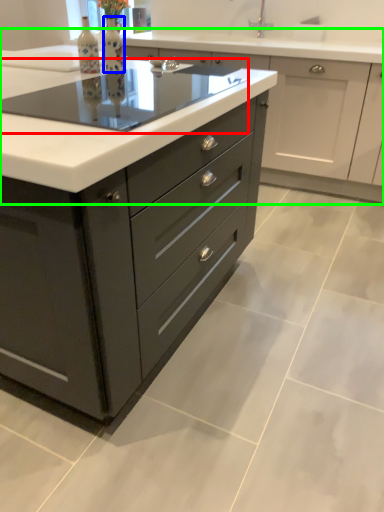
Question: Which object is the farthest from appliance (highlighted by a red box)? Choose among these: bottle (highlighted by a blue box) or cabinetry (highlighted by a green box).

Choices:
 (A) bottle
 (B) cabinetry

Answer: (B)